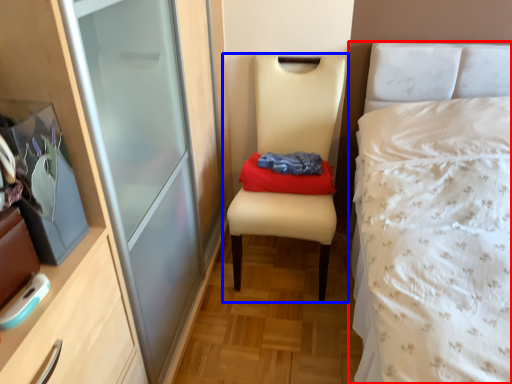
Question: Which object is closer to the camera taking this photo, bed (highlighted by a red box) or chair (highlighted by a blue box)?

Choices:
 (A) bed
 (B) chair

Answer: (A)